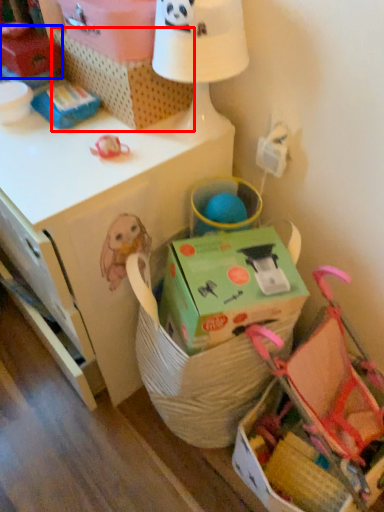
Question: Which of the following is the closest to the observer, storage box (highlighted by a red box) or storage box (highlighted by a blue box)?

Choices:
 (A) storage box
 (B) storage box

Answer: (A)